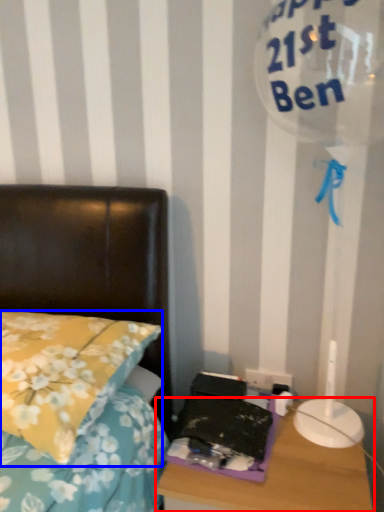
Question: Which of the following is the farthest to the observer, nightstand (highlighted by a red box) or pillow (highlighted by a blue box)?

Choices:
 (A) nightstand
 (B) pillow

Answer: (A)